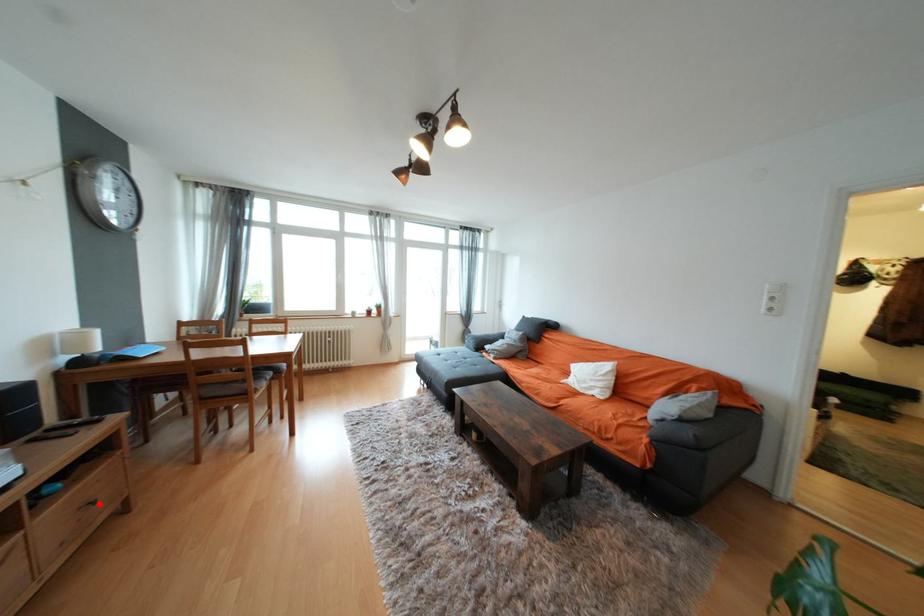
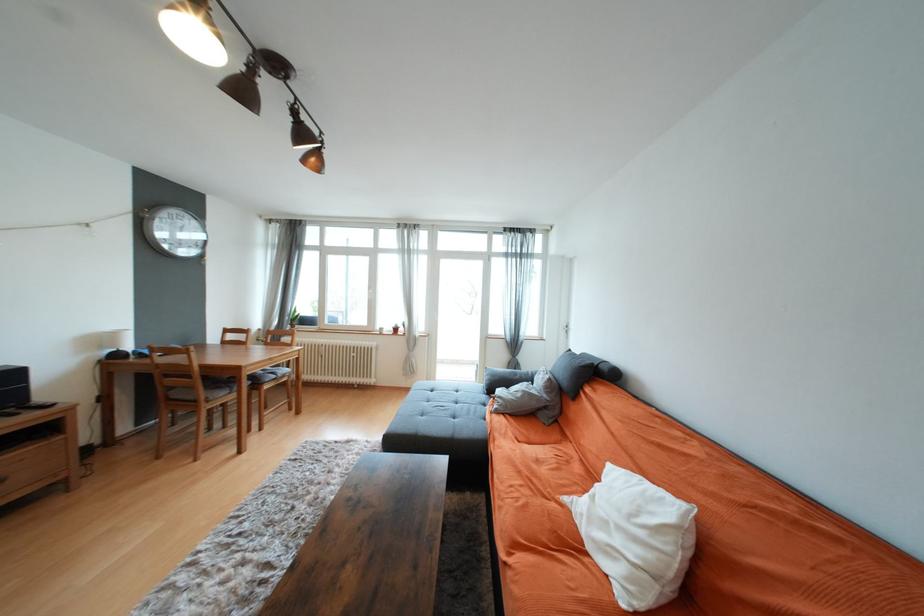
Question: I am providing you with two images of the same scene from different viewpoints. A red point is shown in image1. For the corresponding object point in image2, is it positioned nearer or farther from the camera?

Choices:
 (A) Nearer
 (B) Farther

Answer: (A)